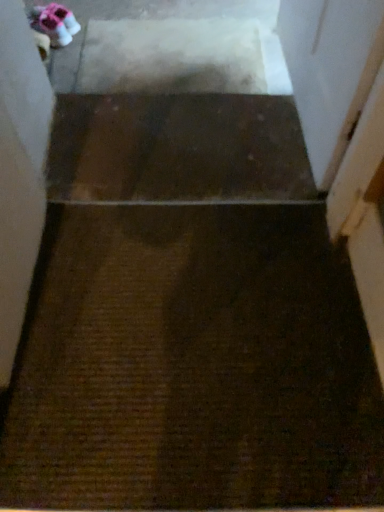
Question: Does matte pink fabric shoe at upper left come behind transparent plastic screen door at upper right?

Choices:
 (A) yes
 (B) no

Answer: (A)

Question: Considering the relative sizes of matte pink fabric shoe at upper left and transparent plastic screen door at upper right in the image provided, is matte pink fabric shoe at upper left shorter than transparent plastic screen door at upper right?

Choices:
 (A) yes
 (B) no

Answer: (A)

Question: Is matte pink fabric shoe at upper left aimed at transparent plastic screen door at upper right?

Choices:
 (A) no
 (B) yes

Answer: (B)

Question: Is matte pink fabric shoe at upper left closer to camera compared to transparent plastic screen door at upper right?

Choices:
 (A) yes
 (B) no

Answer: (B)

Question: Considering the relative sizes of matte pink fabric shoe at upper left and transparent plastic screen door at upper right in the image provided, is matte pink fabric shoe at upper left thinner than transparent plastic screen door at upper right?

Choices:
 (A) yes
 (B) no

Answer: (B)

Question: Does matte pink fabric shoe at upper left have a larger size compared to transparent plastic screen door at upper right?

Choices:
 (A) no
 (B) yes

Answer: (A)

Question: Is transparent plastic screen door at upper right not within brown textured carpet at center?

Choices:
 (A) yes
 (B) no

Answer: (A)

Question: Is transparent plastic screen door at upper right wider than brown textured carpet at center?

Choices:
 (A) yes
 (B) no

Answer: (B)

Question: Is transparent plastic screen door at upper right turned away from brown textured carpet at center?

Choices:
 (A) yes
 (B) no

Answer: (B)

Question: Is the position of transparent plastic screen door at upper right more distant than that of brown textured carpet at center?

Choices:
 (A) yes
 (B) no

Answer: (B)

Question: Is transparent plastic screen door at upper right next to brown textured carpet at center?

Choices:
 (A) no
 (B) yes

Answer: (A)

Question: Can you confirm if transparent plastic screen door at upper right is bigger than brown textured carpet at center?

Choices:
 (A) no
 (B) yes

Answer: (B)

Question: Considering the relative sizes of brown textured carpet at center and transparent plastic screen door at upper right in the image provided, is brown textured carpet at center bigger than transparent plastic screen door at upper right?

Choices:
 (A) no
 (B) yes

Answer: (A)